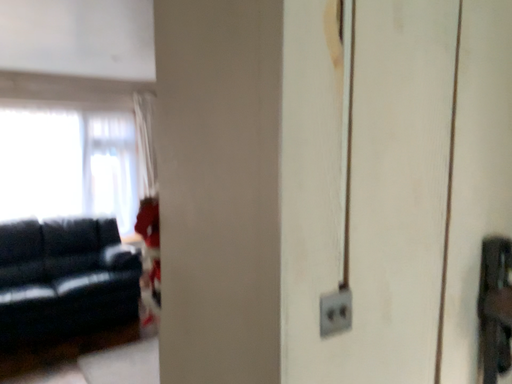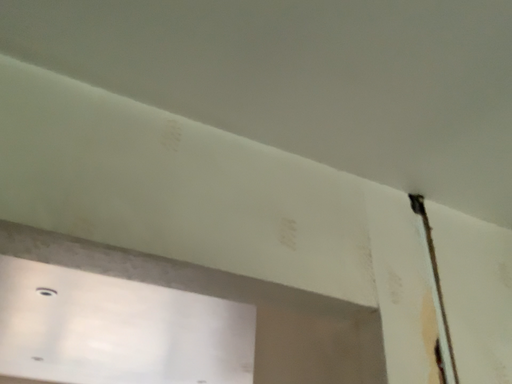
Question: Which way did the camera rotate in the video?

Choices:
 (A) rotated left
 (B) rotated right

Answer: (A)